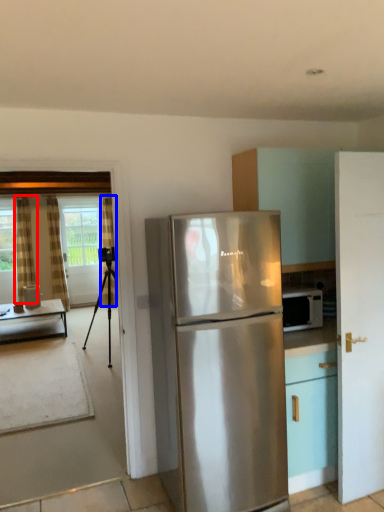
Question: Which point is closer to the camera, curtain (highlighted by a red box) or curtain (highlighted by a blue box)?

Choices:
 (A) curtain
 (B) curtain

Answer: (A)